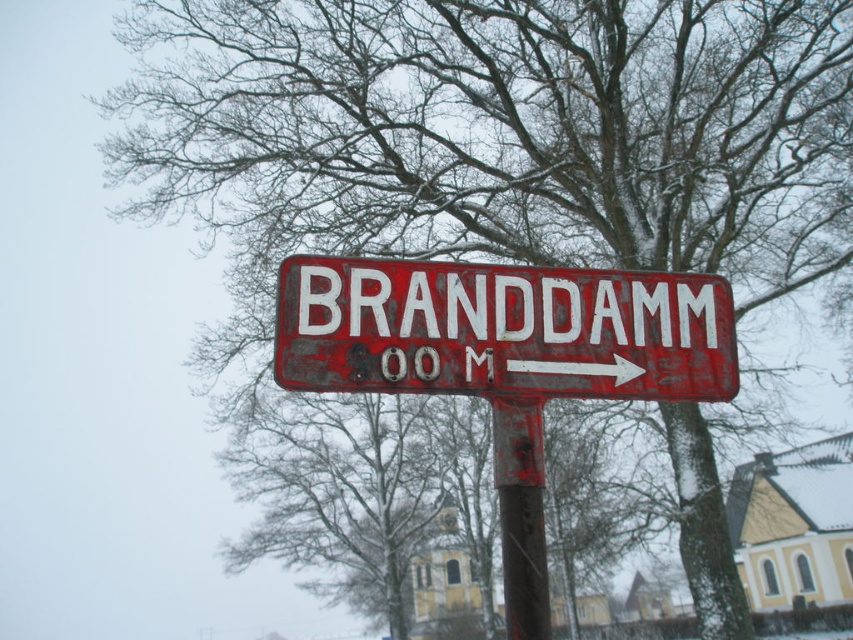
Does rusty metal sign at center lie behind rusty metal pole at center?

No.

Identify the location of rusty metal sign at center. The height and width of the screenshot is (640, 853). (502, 330).